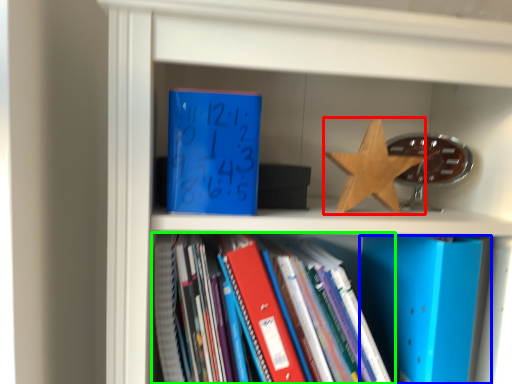
Question: Which is farther away from star (highlighted by a red box)? paperback book (highlighted by a blue box) or book (highlighted by a green box)?

Choices:
 (A) paperback book
 (B) book

Answer: (B)